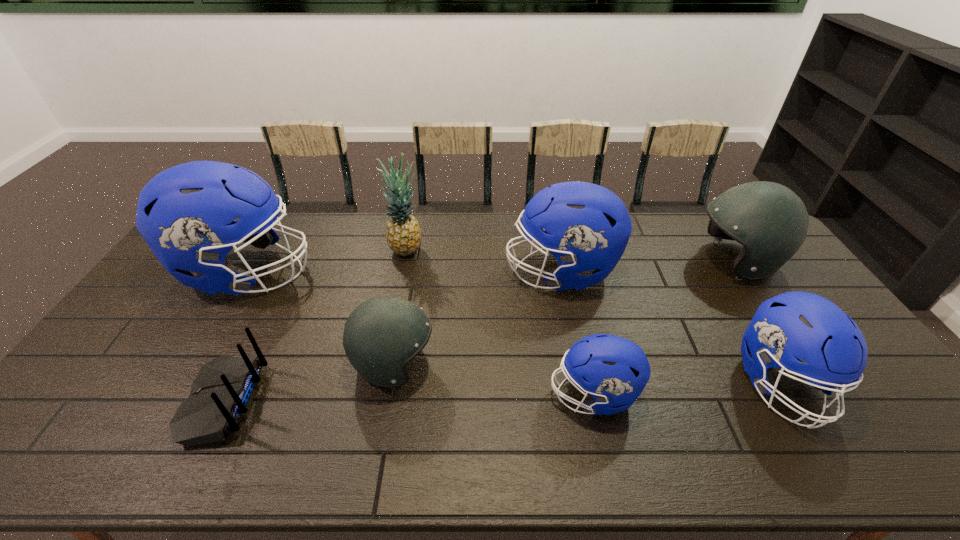
Find the location of `black router`. black router is located at coordinates (221, 394).

Where is `free space located on the front-facing side of the tallest football helmet`? The width and height of the screenshot is (960, 540). free space located on the front-facing side of the tallest football helmet is located at coordinates (356, 272).

This screenshot has width=960, height=540. I want to click on vacant area located 0.110m on the right of the pineapple, so click(x=454, y=249).

Image resolution: width=960 pixels, height=540 pixels. In order to click on free space located on the front-facing side of the third smallest blue football helmet in this screenshot , I will do `click(430, 272)`.

Find the location of a particular element. The image size is (960, 540). free location located 0.390m on the front-facing side of the third smallest blue football helmet is located at coordinates (388, 272).

Locate an element on the screen. The image size is (960, 540). free location located on the front-facing side of the third smallest blue football helmet is located at coordinates point(475,272).

The image size is (960, 540). What are the coordinates of `vacant space located at the face opening of the farther green football helmet` in the screenshot? It's located at (622, 261).

Where is `free spot located at the face opening of the farther green football helmet`? The height and width of the screenshot is (540, 960). free spot located at the face opening of the farther green football helmet is located at coordinates (575, 261).

Locate an element on the screen. This screenshot has width=960, height=540. free space located at the face opening of the farther green football helmet is located at coordinates (601, 261).

The width and height of the screenshot is (960, 540). Identify the location of blank area located on the front-facing side of the rightmost blue football helmet. (826, 458).